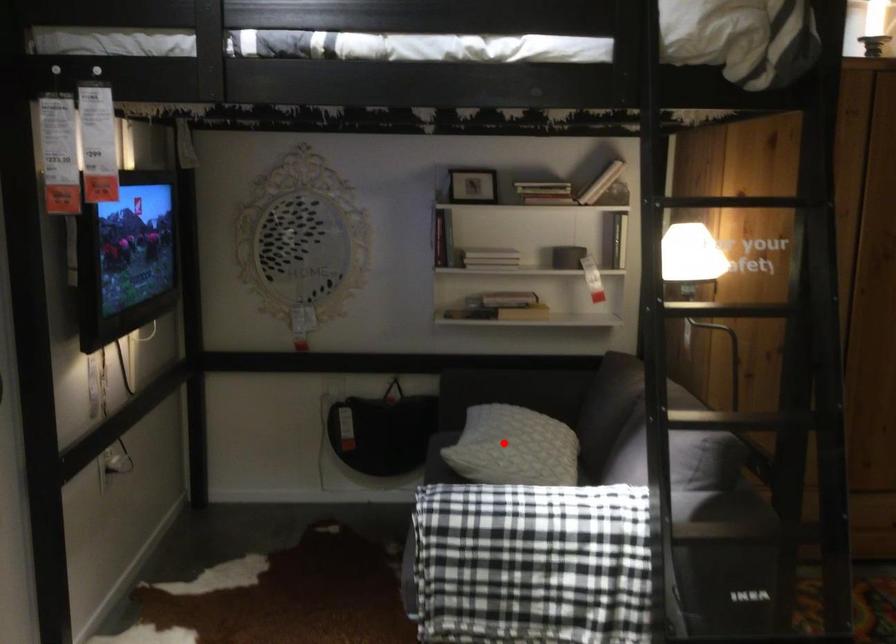
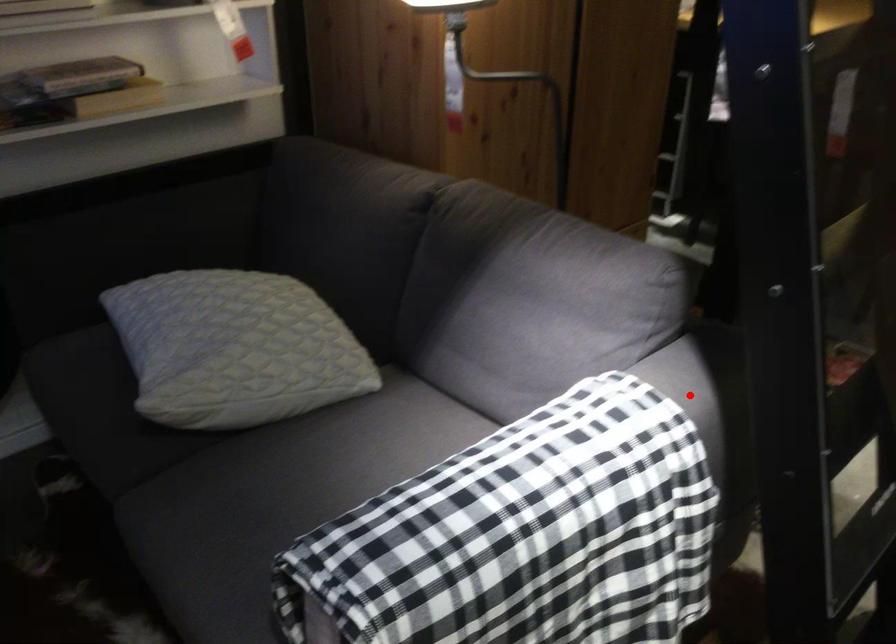
I am providing you with two images of the same scene from different viewpoints. A red point is marked on the first image and another point is marked on the second image. Do the highlighted points in image1 and image2 indicate the same real-world spot?

No